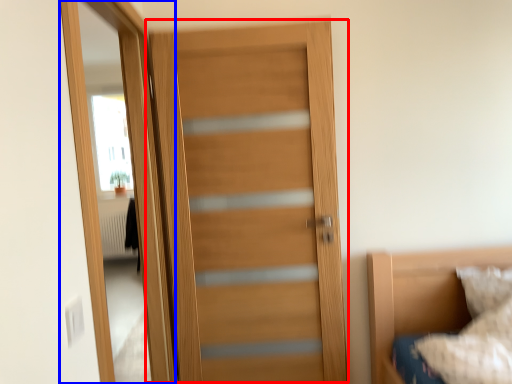
Question: Which of the following is the farthest to the observer, door (highlighted by a red box) or screen door (highlighted by a blue box)?

Choices:
 (A) door
 (B) screen door

Answer: (A)